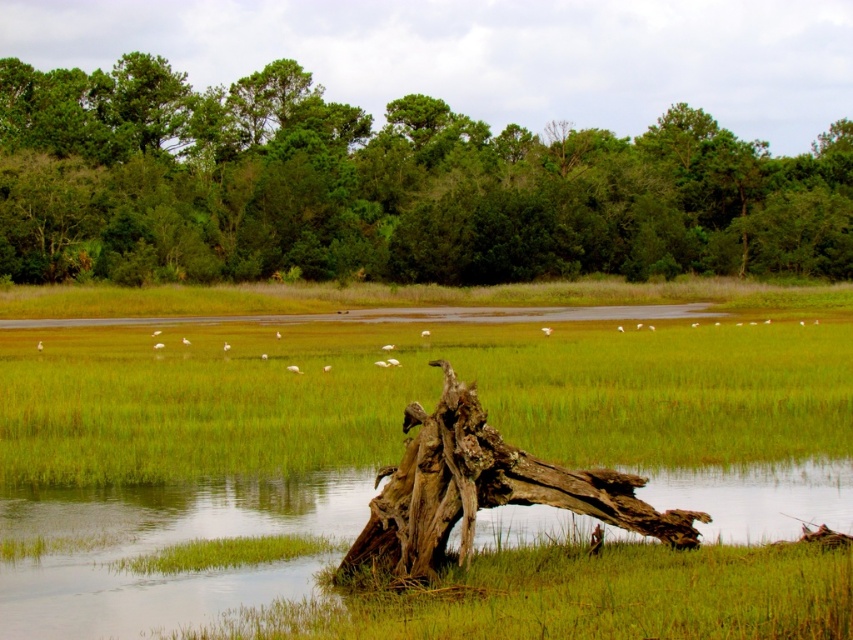
You are standing at the edge of the wetland and see the green leafy tree at upper center and the green grass at center. Which object is positioned higher in the image?

The green leafy tree at upper center is located above the green grass at center, so it is positioned higher in the image.

You are standing at the origin point in this wetland scene. A drone is flying above the green grass at center. If the drone moves 0.2 units to the right and 0.1 units down from its current position, what are its new coordinates?

The drone was originally at the green grass at center located at point (x=416, y=394). Moving 0.2 units right increases the x coordinate to 0.617 plus 0.2 equals 0.817. Moving 0.1 units down increases the y coordinate to 0.489 plus 0.1 equals 0.589. The new coordinates are (x=502, y=522).

You are standing at the edge of the wetland and want to take a photo of both the point at coordinates point (776,326) and point (236,577). Which point will appear closer to the bottom of your camera viewfinder?

Point (236,577) will appear closer to the bottom of the camera viewfinder because it is closer to the camera compared to point (776,326), which is further away.